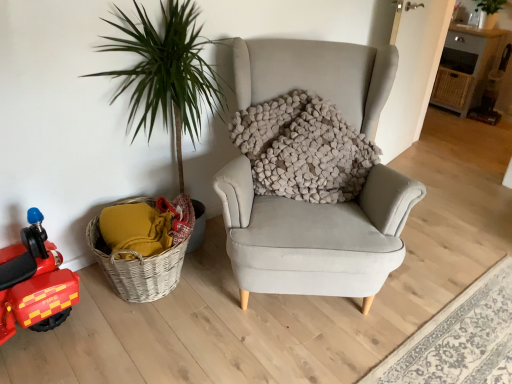
Question: From a real-world perspective, is light gray fabric rug at lower right below woven wood table at upper right?

Choices:
 (A) yes
 (B) no

Answer: (A)

Question: Is light gray fabric rug at lower right surrounding woven wood table at upper right?

Choices:
 (A) no
 (B) yes

Answer: (A)

Question: Is light gray fabric rug at lower right outside woven wood table at upper right?

Choices:
 (A) yes
 (B) no

Answer: (A)

Question: Is light gray fabric rug at lower right next to woven wood table at upper right and touching it?

Choices:
 (A) no
 (B) yes

Answer: (A)

Question: Is light gray fabric rug at lower right oriented away from woven wood table at upper right?

Choices:
 (A) yes
 (B) no

Answer: (B)

Question: From the image's perspective, relative to shiny red plastic toy car at left, is woven wood table at upper right above or below?

Choices:
 (A) below
 (B) above

Answer: (B)

Question: Does point (444, 99) appear closer or farther from the camera than point (18, 281)?

Choices:
 (A) farther
 (B) closer

Answer: (A)

Question: Considering the positions of woven wood table at upper right and shiny red plastic toy car at left in the image, is woven wood table at upper right taller or shorter than shiny red plastic toy car at left?

Choices:
 (A) tall
 (B) short

Answer: (A)

Question: From a real-world perspective, is woven wood table at upper right above or below shiny red plastic toy car at left?

Choices:
 (A) above
 (B) below

Answer: (A)

Question: Choose the correct answer: Is light gray fabric rug at lower right inside shiny red plastic toy car at left or outside it?

Choices:
 (A) inside
 (B) outside

Answer: (B)

Question: From a real-world perspective, relative to shiny red plastic toy car at left, is light gray fabric rug at lower right vertically above or below?

Choices:
 (A) above
 (B) below

Answer: (B)

Question: Is light gray fabric rug at lower right taller or shorter than shiny red plastic toy car at left?

Choices:
 (A) tall
 (B) short

Answer: (B)

Question: Considering their positions, is light gray fabric rug at lower right located in front of or behind shiny red plastic toy car at left?

Choices:
 (A) behind
 (B) front

Answer: (A)

Question: Is point (66, 306) positioned closer to the camera than point (450, 66)?

Choices:
 (A) closer
 (B) farther

Answer: (A)

Question: In the image, is shiny red plastic toy car at left positioned in front of or behind woven wood table at upper right?

Choices:
 (A) behind
 (B) front

Answer: (B)